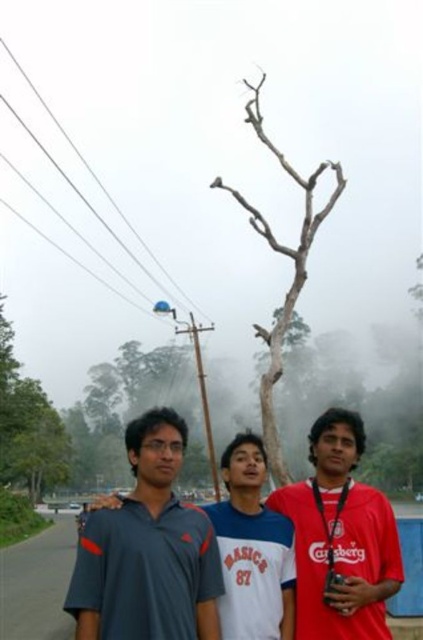
Question: Can you confirm if red matte shirt at center is wider than white cotton shirt at center?

Choices:
 (A) yes
 (B) no

Answer: (A)

Question: Which point is closer to the camera?

Choices:
 (A) matte gray shirt at center
 (B) gray bark tree at center

Answer: (A)

Question: Considering the relative positions of matte gray shirt at center and red matte shirt at center in the image provided, where is matte gray shirt at center located with respect to red matte shirt at center?

Choices:
 (A) above
 (B) below

Answer: (B)

Question: Estimate the real-world distances between objects in this image. Which object is closer to the matte gray shirt at center?

Choices:
 (A) gray bark tree at center
 (B) white cotton shirt at center
 (C) red matte shirt at center

Answer: (B)

Question: Which object appears closest to the camera in this image?

Choices:
 (A) gray bark tree at center
 (B) matte gray shirt at center
 (C) red matte shirt at center
 (D) white cotton shirt at center

Answer: (B)

Question: Observing the image, what is the correct spatial positioning of red matte shirt at center in reference to gray bark tree at center?

Choices:
 (A) right
 (B) left

Answer: (B)